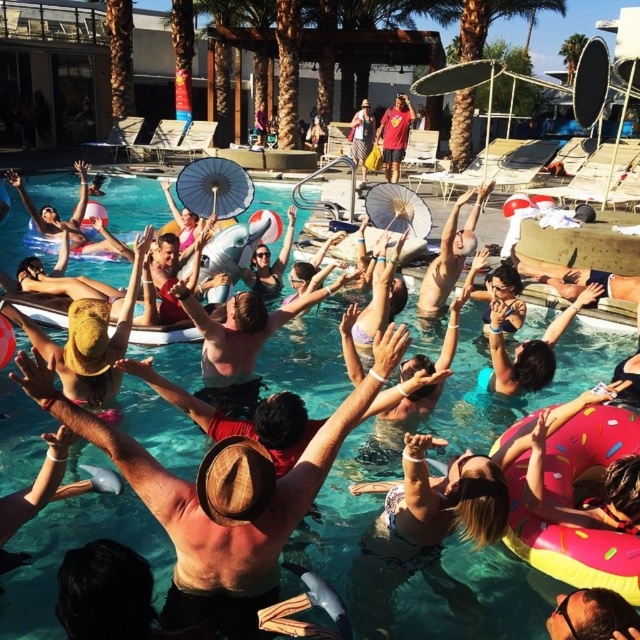
Question: Does white paper umbrella at upper center have a greater width compared to denim shorts at center?

Choices:
 (A) yes
 (B) no

Answer: (A)

Question: Which point is farther to the camera?

Choices:
 (A) (424, 596)
 (B) (387, 170)
 (C) (198, 211)
 (D) (576, 595)

Answer: (B)

Question: Can you confirm if clear blue water at center is positioned below smooth skin man at center?

Choices:
 (A) yes
 (B) no

Answer: (B)

Question: Which is nearer to the white paper umbrella at upper center?

Choices:
 (A) brown straw hat at center
 (B) reddish-brown fabric shorts at upper center
 (C) matte paper parasol at upper center

Answer: (C)

Question: Based on their relative distances, which object is farther from the smooth tan skin at upper center?

Choices:
 (A) brown straw hat at center
 (B) white paper umbrella at upper center
 (C) reddish-brown fabric shorts at upper center

Answer: (C)

Question: Is smooth skin man at center above matte paper parasol at upper center?

Choices:
 (A) no
 (B) yes

Answer: (A)